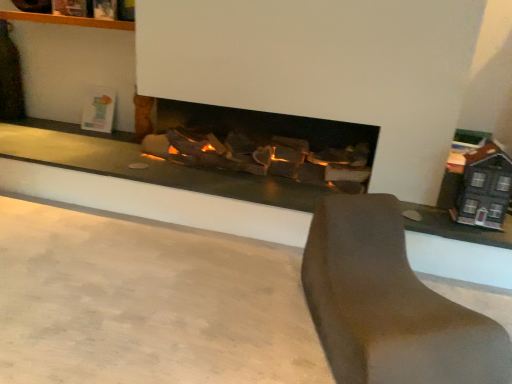
Image resolution: width=512 pixels, height=384 pixels. What do you see at coordinates (147, 304) in the screenshot?
I see `smooth concrete at center` at bounding box center [147, 304].

Locate an element on the screen. Image resolution: width=512 pixels, height=384 pixels. smooth concrete at center is located at coordinates (147, 304).

Describe the element at coordinates (389, 304) in the screenshot. I see `brown matte chair at lower right` at that location.

The height and width of the screenshot is (384, 512). In order to click on brown matte chair at lower right in this screenshot , I will do `click(389, 304)`.

Locate an element on the screen. The image size is (512, 384). smooth concrete at center is located at coordinates (147, 304).

Which is more to the right, brown matte chair at lower right or smooth concrete at center?

Positioned to the right is brown matte chair at lower right.

Is brown matte chair at lower right further to camera compared to smooth concrete at center?

Yes, brown matte chair at lower right is further from the camera.

Considering the positions of points (398, 260) and (184, 321), is point (398, 260) closer to camera compared to point (184, 321)?

Yes, point (398, 260) is in front of point (184, 321).

From the image's perspective, which is below, brown matte chair at lower right or smooth concrete at center?

From the image's view, smooth concrete at center is below.

From a real-world perspective, is brown matte chair at lower right positioned above or below smooth concrete at center?

From a real-world perspective, brown matte chair at lower right is physically above smooth concrete at center.

In the scene shown: Considering the sizes of objects brown matte chair at lower right and smooth concrete at center in the image provided, who is wider, brown matte chair at lower right or smooth concrete at center?

Wider between the two is smooth concrete at center.

Which of these two, brown matte chair at lower right or smooth concrete at center, stands taller?

brown matte chair at lower right.

Looking at this image, is brown matte chair at lower right bigger than smooth concrete at center?

Indeed, brown matte chair at lower right has a larger size compared to smooth concrete at center.

Choose the correct answer: Is brown matte chair at lower right inside smooth concrete at center or outside it?

brown matte chair at lower right is outside smooth concrete at center.

Does brown matte chair at lower right touch smooth concrete at center?

No, brown matte chair at lower right is not next to smooth concrete at center.

Is brown matte chair at lower right positioned with its back to smooth concrete at center?

brown matte chair at lower right is not turned away from smooth concrete at center.

How much distance is there between brown matte chair at lower right and smooth concrete at center?

They are 18.33 inches apart.

This screenshot has height=384, width=512. Identify the location of furniture positioned vertically above the smooth concrete at center (from a real-world perspective). (389, 304).

Does smooth concrete at center appear on the left side of brown matte chair at lower right?

Yes, smooth concrete at center is to the left of brown matte chair at lower right.

Relative to brown matte chair at lower right, is smooth concrete at center in front or behind?

In the image, smooth concrete at center appears in front of brown matte chair at lower right.

Does point (222, 237) come closer to viewer compared to point (452, 352)?

No, (222, 237) is further to viewer.

From the image's perspective, is smooth concrete at center positioned above or below brown matte chair at lower right?

smooth concrete at center is below brown matte chair at lower right.

From a real-world perspective, is smooth concrete at center beneath brown matte chair at lower right?

Yes, from a real-world perspective, smooth concrete at center is below brown matte chair at lower right.

From the picture: Which object is wider, smooth concrete at center or brown matte chair at lower right?

Wider between the two is smooth concrete at center.

Can you confirm if smooth concrete at center is shorter than brown matte chair at lower right?

Indeed, smooth concrete at center has a lesser height compared to brown matte chair at lower right.

Considering the relative sizes of smooth concrete at center and brown matte chair at lower right in the image provided, is smooth concrete at center bigger than brown matte chair at lower right?

No, smooth concrete at center is not bigger than brown matte chair at lower right.

Could brown matte chair at lower right be considered to be inside smooth concrete at center?

No, brown matte chair at lower right is not inside smooth concrete at center.

Is smooth concrete at center beside brown matte chair at lower right?

No, smooth concrete at center is not beside brown matte chair at lower right.

Based on the photo, is smooth concrete at center aimed at brown matte chair at lower right?

No, smooth concrete at center is not facing towards brown matte chair at lower right.

What's the angular difference between smooth concrete at center and brown matte chair at lower right's facing directions?

122 degrees separate the facing orientations of smooth concrete at center and brown matte chair at lower right.

I want to click on concrete that appears below the brown matte chair at lower right (from a real-world perspective), so click(147, 304).

Locate an element on the screen. The image size is (512, 384). concrete in front of the brown matte chair at lower right is located at coordinates (147, 304).

Where is `concrete on the left of brown matte chair at lower right`? The height and width of the screenshot is (384, 512). concrete on the left of brown matte chair at lower right is located at coordinates (147, 304).